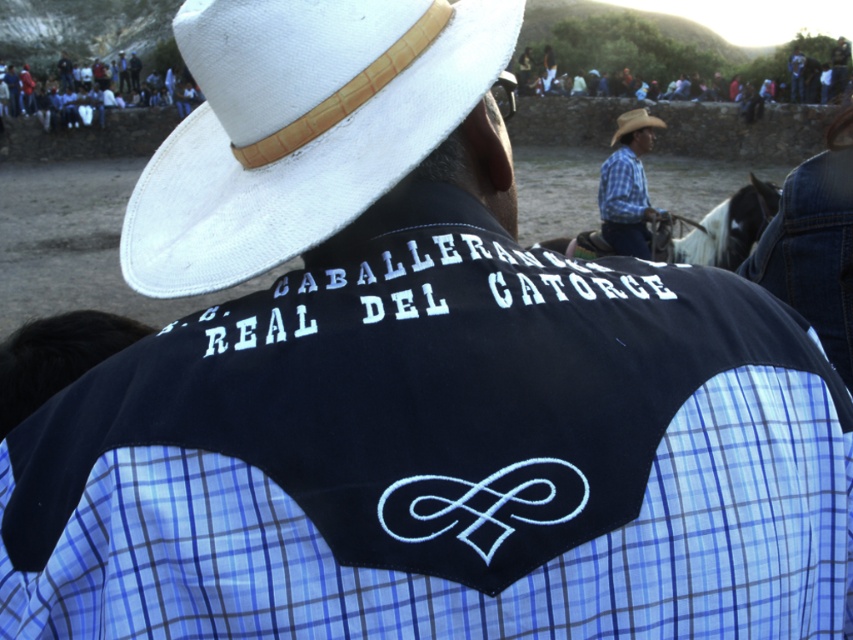
You are a photographer trying to capture the best shot of the blue plaid shirt at center and the blue jeans at upper center. Which object should you focus on first if you want to photograph the taller one?

The blue jeans at upper center is taller than the blue plaid shirt at center, so you should focus on the blue jeans at upper center first.

You are an event organizer planning to take a group photo of the participants. You notice the blue plaid shirt at center and the blue jeans at upper center in the image. Which clothing item should you adjust to ensure both are equally visible in the photo?

Answer: The blue plaid shirt at center occupies less space than the blue jeans at upper center, so you should adjust the blue jeans at upper center to make it smaller or move it closer to the blue plaid shirt at center to balance their visibility.